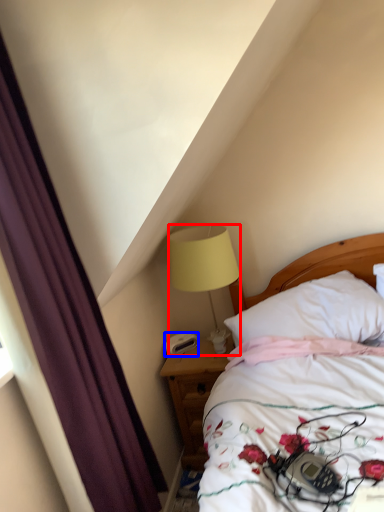
Question: Which object is further to the camera taking this photo, lamp (highlighted by a red box) or alarm clock (highlighted by a blue box)?

Choices:
 (A) lamp
 (B) alarm clock

Answer: (B)